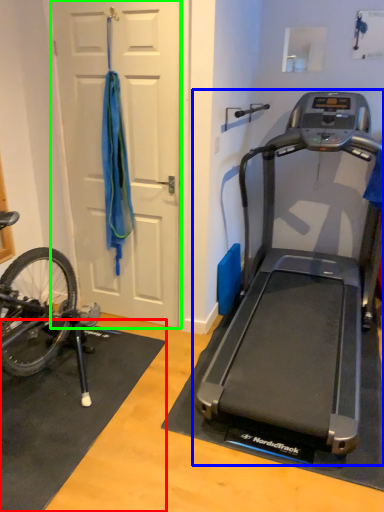
Question: Considering the real-world distances, which object is closest to doormat (highlighted by a red box)? treadmill (highlighted by a blue box) or door (highlighted by a green box).

Choices:
 (A) treadmill
 (B) door

Answer: (A)